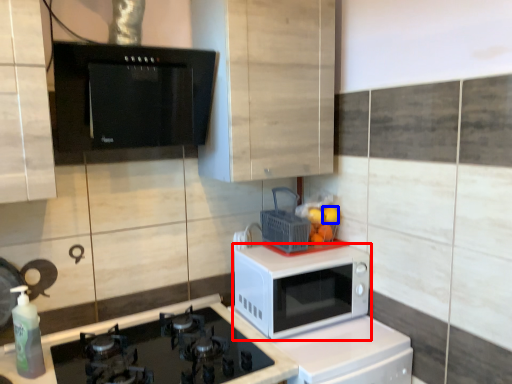
Question: Among these objects, which one is nearest to the camera, microwave oven (highlighted by a red box) or orange (highlighted by a blue box)?

Choices:
 (A) microwave oven
 (B) orange

Answer: (A)